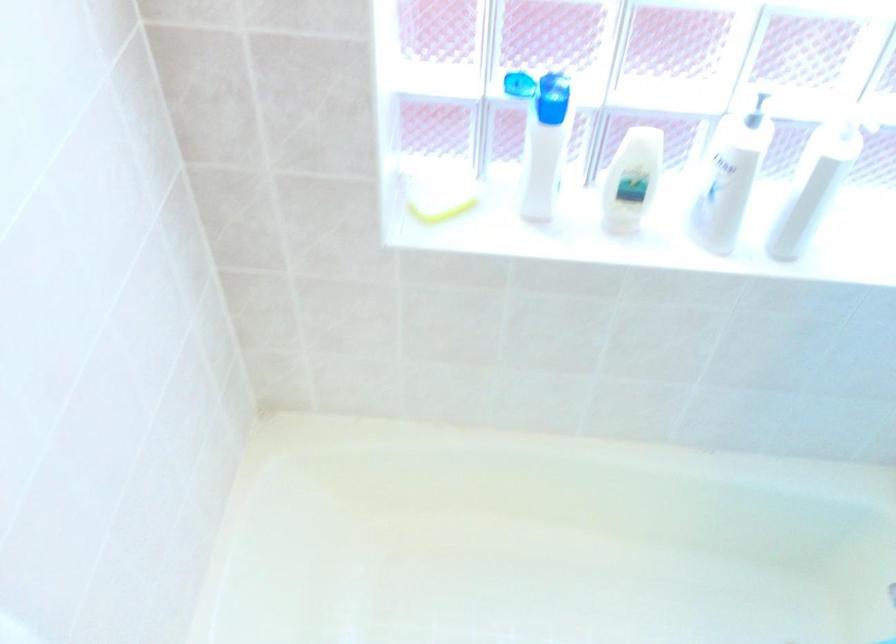
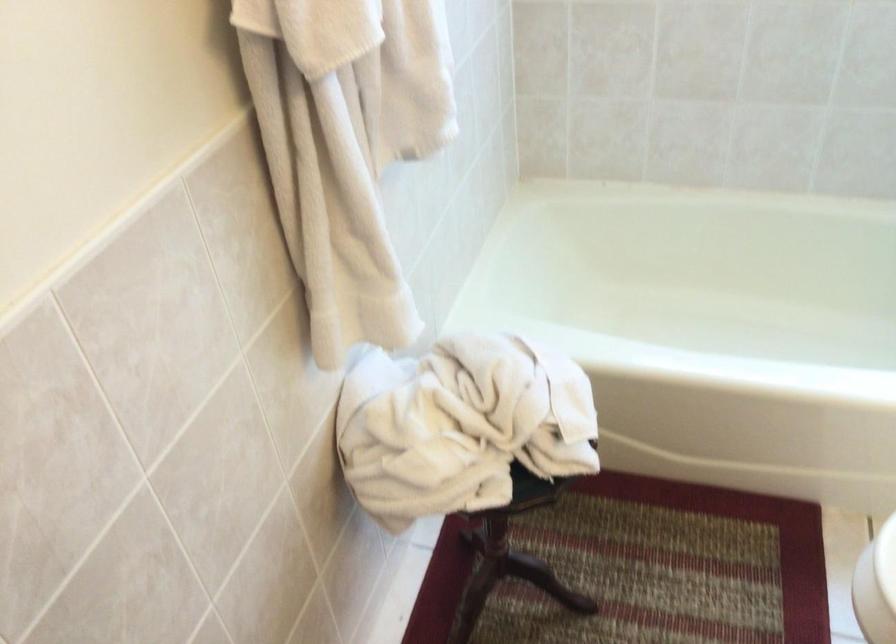
Locate, in the second image, the point that corresponds to (x=464, y=522) in the first image.

(698, 283)